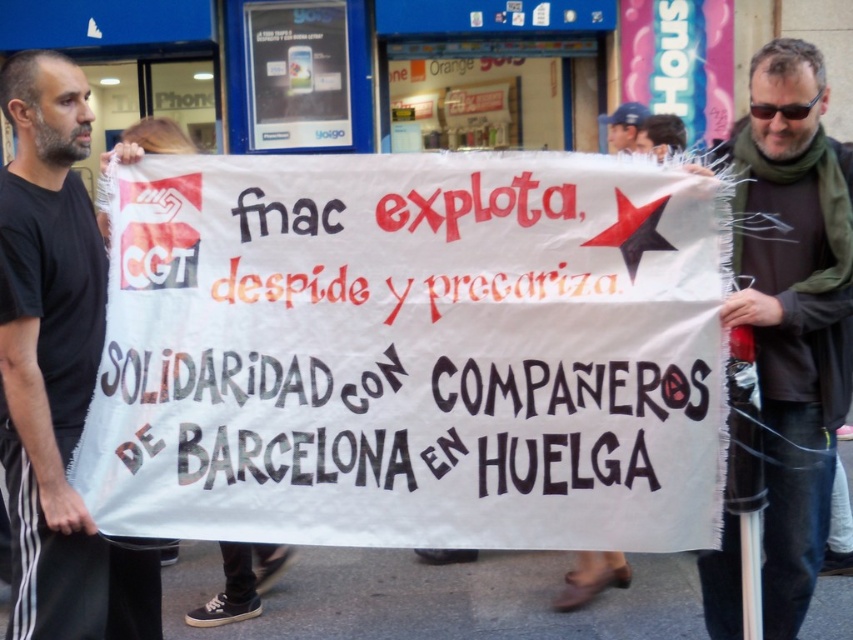
Which is more to the right, white paper banner at center or dark brown leather jacket at center?

From the viewer's perspective, dark brown leather jacket at center appears more on the right side.

Can you confirm if white paper banner at center is shorter than dark brown leather jacket at center?

Correct, white paper banner at center is not as tall as dark brown leather jacket at center.

Identify the location of white paper banner at center. (412, 353).

Does white paper banner at center have a smaller size compared to black fabric at left?

Yes, white paper banner at center is smaller than black fabric at left.

Does point (479, 225) lie behind point (3, 285)?

Yes, point (479, 225) is farther from viewer.

Is point (265, 525) positioned behind point (83, 200)?

No, it is not.

This screenshot has height=640, width=853. Identify the location of white paper banner at center. pos(412,353).

Does black fabric at left have a larger size compared to dark brown leather jacket at center?

No.

Between black fabric at left and dark brown leather jacket at center, which one is positioned higher?

Positioned higher is dark brown leather jacket at center.

Is point (134, 557) farther from viewer compared to point (838, 358)?

Yes, point (134, 557) is behind point (838, 358).

This screenshot has width=853, height=640. Identify the location of black fabric at left. (56, 369).